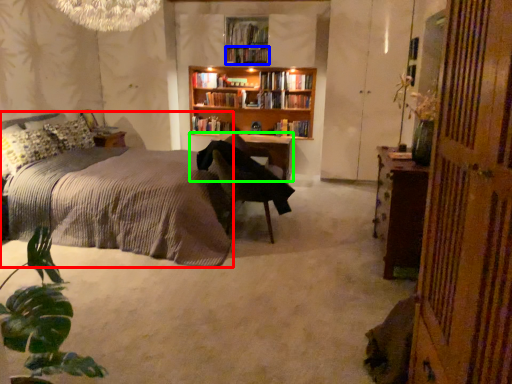
Question: Which object is positioned farthest from bed (highlighted by a red box)? Select from book (highlighted by a blue box) and table (highlighted by a green box).

Choices:
 (A) book
 (B) table

Answer: (A)